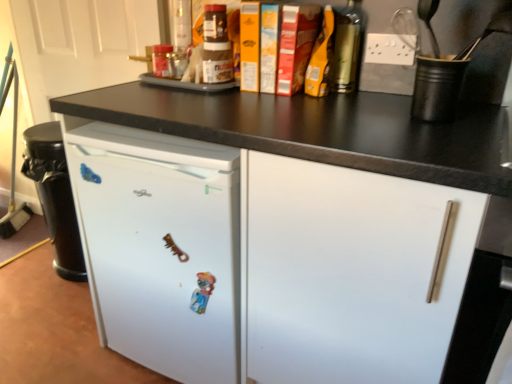
Question: Considering the relative positions of white matte drawer at center and white matte door at upper left in the image provided, is white matte drawer at center to the right of white matte door at upper left from the viewer's perspective?

Choices:
 (A) yes
 (B) no

Answer: (A)

Question: Is white matte drawer at center oriented towards white matte door at upper left?

Choices:
 (A) no
 (B) yes

Answer: (A)

Question: Is white matte drawer at center at the left side of white matte door at upper left?

Choices:
 (A) yes
 (B) no

Answer: (B)

Question: From the image's perspective, would you say white matte drawer at center is positioned over white matte door at upper left?

Choices:
 (A) yes
 (B) no

Answer: (B)

Question: Does white matte drawer at center have a lesser width compared to white matte door at upper left?

Choices:
 (A) no
 (B) yes

Answer: (A)

Question: Is white matte drawer at center facing away from white matte door at upper left?

Choices:
 (A) no
 (B) yes

Answer: (A)

Question: Is metallic gold bottle at upper right, which is the first bottle from front to back, thinner than black matte cup at upper right?

Choices:
 (A) yes
 (B) no

Answer: (A)

Question: Is metallic gold bottle at upper right, the first bottle when ordered from right to left, facing towards black matte cup at upper right?

Choices:
 (A) yes
 (B) no

Answer: (B)

Question: From a real-world perspective, is metallic gold bottle at upper right, which is the first bottle from front to back, physically above black matte cup at upper right?

Choices:
 (A) yes
 (B) no

Answer: (A)

Question: Is metallic gold bottle at upper right, which is counted as the second bottle, starting from the left, wider than black matte cup at upper right?

Choices:
 (A) yes
 (B) no

Answer: (B)

Question: Is metallic gold bottle at upper right, the first bottle when ordered from right to left, to the left of black matte cup at upper right from the viewer's perspective?

Choices:
 (A) yes
 (B) no

Answer: (A)

Question: Is black matte cup at upper right a part of metallic gold bottle at upper right, placed as the 2th bottle when sorted from back to front?

Choices:
 (A) no
 (B) yes

Answer: (A)

Question: Does white matte drawer at center have a larger size compared to metallic gold bottle at upper right, placed as the 2th bottle when sorted from back to front?

Choices:
 (A) yes
 (B) no

Answer: (A)